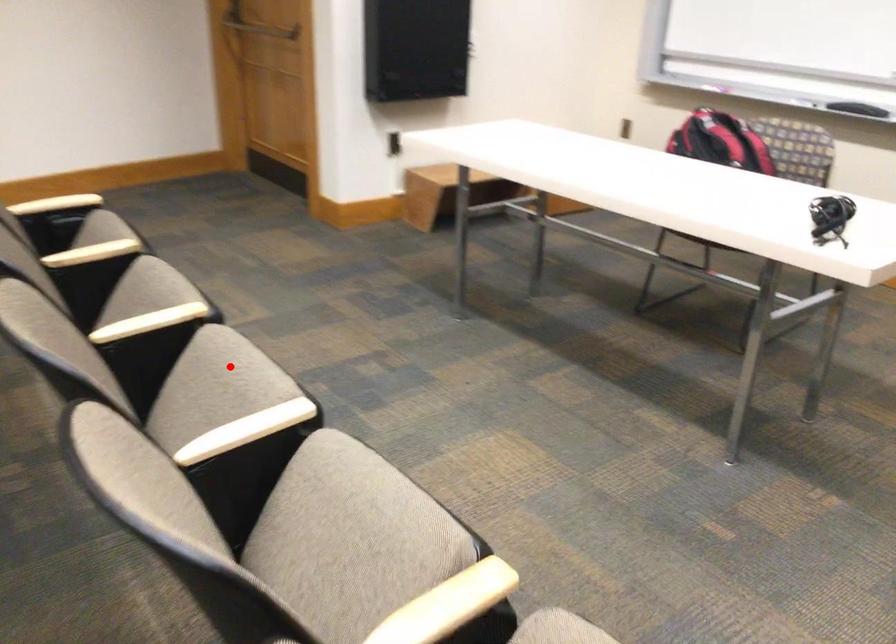
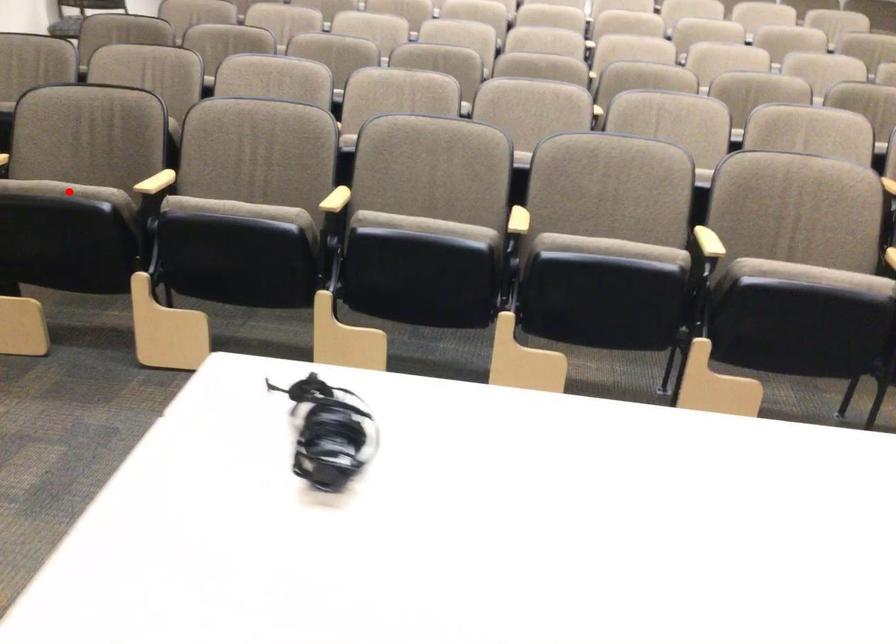
I am providing you with two images of the same scene from different viewpoints. A red point is marked on the first image and another point is marked on the second image. Do the highlighted points in image1 and image2 indicate the same real-world spot?

No